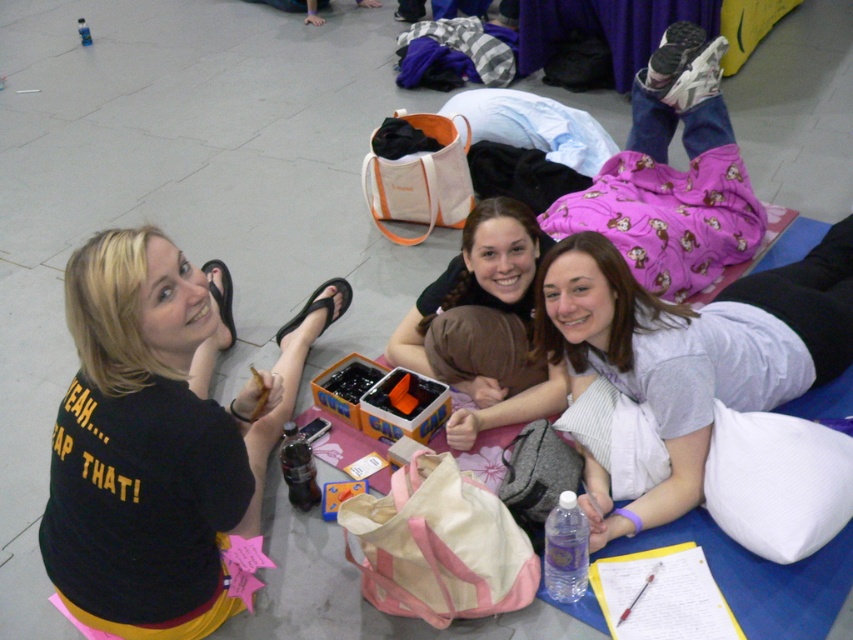
Question: Is black matte shirt at upper left closer to camera compared to matte black hair at center?

Choices:
 (A) no
 (B) yes

Answer: (B)

Question: Which object is closer to the camera taking this photo?

Choices:
 (A) light gray cotton shirt at center
 (B) matte black hair at center

Answer: (A)

Question: Considering the real-world distances, which object is farthest from the black matte shirt at upper left?

Choices:
 (A) light gray cotton shirt at center
 (B) matte black hair at center

Answer: (A)

Question: Is black matte shirt at upper left closer to camera compared to light gray cotton shirt at center?

Choices:
 (A) no
 (B) yes

Answer: (B)

Question: Considering the real-world distances, which object is farthest from the black matte shirt at upper left?

Choices:
 (A) light gray cotton shirt at center
 (B) matte black hair at center

Answer: (A)

Question: Can you confirm if black matte shirt at upper left is thinner than matte black hair at center?

Choices:
 (A) no
 (B) yes

Answer: (A)